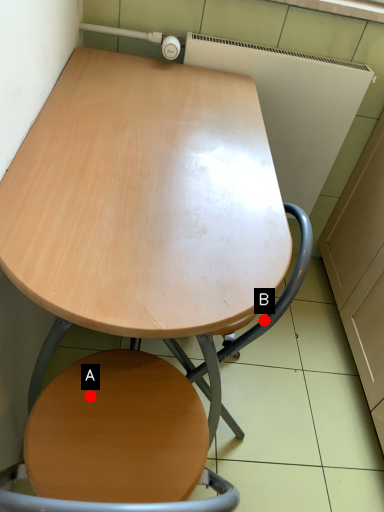
Question: Two points are circled on the image, labeled by A and B beside each circle. Which point is closer to the camera?

Choices:
 (A) A is closer
 (B) B is closer

Answer: (A)